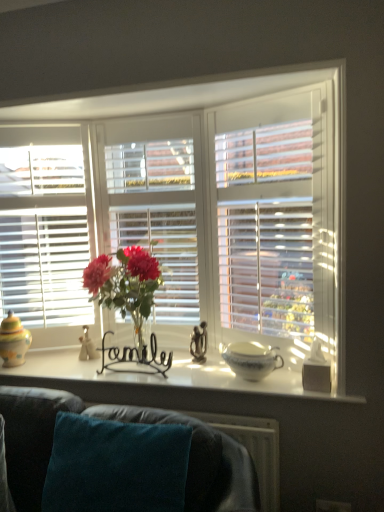
I want to click on free space between multicolored ceramic jar at left, which ranks as the third candle holder in right-to-left order, and white ceramic bowl at center, so click(x=141, y=369).